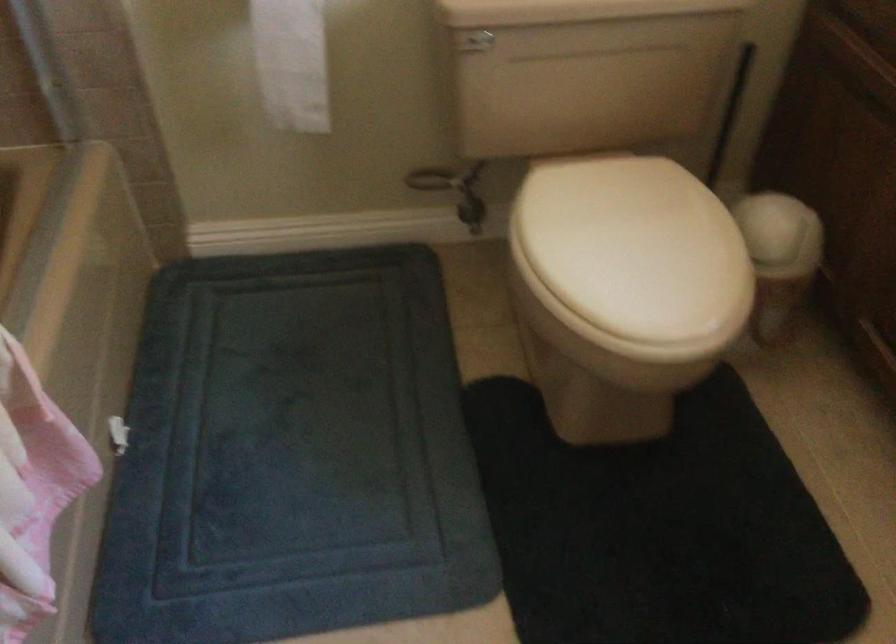
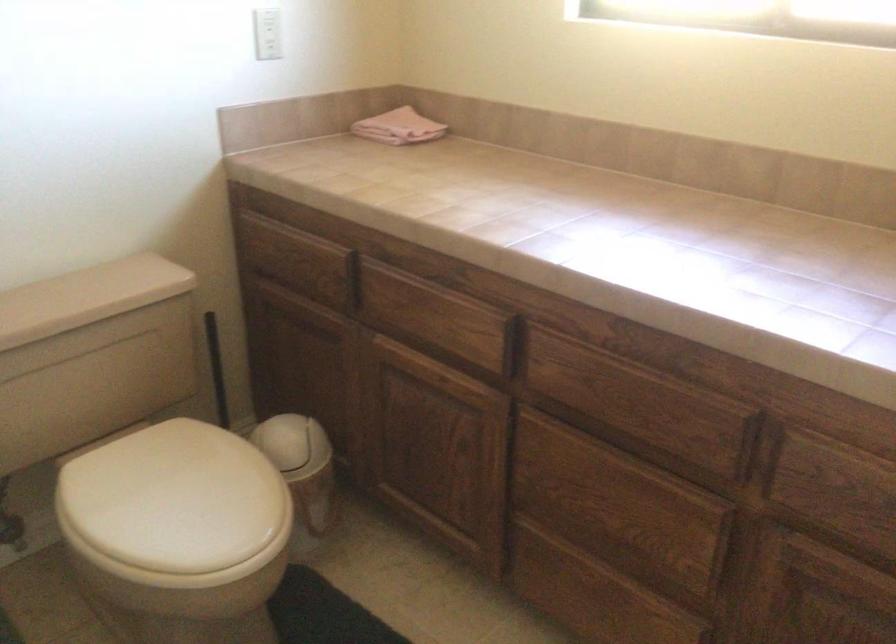
Locate, in the second image, the point that corresponds to (x=771, y=228) in the first image.

(293, 444)